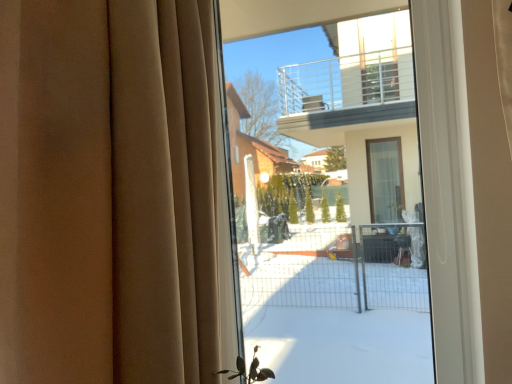
At what (x,y) coordinates should I click in order to perform the action: click on beige fabric curtain at left. Please return your answer as a coordinate pair (x, y). The width and height of the screenshot is (512, 384). Looking at the image, I should click on (106, 192).

Describe the element at coordinates (106, 192) in the screenshot. I see `beige fabric curtain at left` at that location.

What is the approximate height of beige fabric curtain at left?

It is 1.03 meters.

The width and height of the screenshot is (512, 384). What do you see at coordinates (333, 195) in the screenshot?
I see `transparent glass bay window at center` at bounding box center [333, 195].

Identify the location of transparent glass bay window at center. (333, 195).

You are a GUI agent. You are given a task and a screenshot of the screen. Output one action in this format:
    pyautogui.click(x=<x>, y=<y>)
    Task: Click on the beige fabric curtain at left
    The height and width of the screenshot is (384, 512).
    Given the screenshot: What is the action you would take?
    pyautogui.click(x=106, y=192)

Consider the image. Which is more to the left, transparent glass bay window at center or beige fabric curtain at left?

From the viewer's perspective, beige fabric curtain at left appears more on the left side.

Considering the positions of objects transparent glass bay window at center and beige fabric curtain at left in the image provided, who is in front, transparent glass bay window at center or beige fabric curtain at left?

beige fabric curtain at left.

Which is nearer, (372, 295) or (124, 345)?

The point (124, 345) is closer to the camera.

From the image's perspective, which one is positioned higher, transparent glass bay window at center or beige fabric curtain at left?

transparent glass bay window at center appears higher in the image.

From a real-world perspective, which is physically above, transparent glass bay window at center or beige fabric curtain at left?

beige fabric curtain at left.

Looking at this image, between transparent glass bay window at center and beige fabric curtain at left, which one has larger width?

beige fabric curtain at left is wider.

Consider the image. Is transparent glass bay window at center taller or shorter than beige fabric curtain at left?

transparent glass bay window at center is taller than beige fabric curtain at left.

Considering the relative sizes of transparent glass bay window at center and beige fabric curtain at left in the image provided, is transparent glass bay window at center smaller than beige fabric curtain at left?

Indeed, transparent glass bay window at center has a smaller size compared to beige fabric curtain at left.

Would you say transparent glass bay window at center is inside or outside beige fabric curtain at left?

transparent glass bay window at center cannot be found inside beige fabric curtain at left.

Are transparent glass bay window at center and beige fabric curtain at left making contact?

No, transparent glass bay window at center is not in contact with beige fabric curtain at left.

Is transparent glass bay window at center oriented away from beige fabric curtain at left?

No, beige fabric curtain at left is not at the back of transparent glass bay window at center.

What's the angular difference between transparent glass bay window at center and beige fabric curtain at left's facing directions?

They differ by 89.7 degrees in their facing directions.

Where is `curtain below the transparent glass bay window at center (from the image's perspective)`? curtain below the transparent glass bay window at center (from the image's perspective) is located at coordinates (106, 192).

Can you confirm if beige fabric curtain at left is positioned to the right of transparent glass bay window at center?

No.

Is beige fabric curtain at left further to camera compared to transparent glass bay window at center?

No, beige fabric curtain at left is in front of transparent glass bay window at center.

Is point (39, 134) less distant than point (288, 126)?

Yes, it is.

From the image's perspective, who appears lower, beige fabric curtain at left or transparent glass bay window at center?

beige fabric curtain at left is shown below in the image.

Consider the image. From a real-world perspective, which is physically above, beige fabric curtain at left or transparent glass bay window at center?

From a 3D spatial view, beige fabric curtain at left is above.

Consider the image. Considering the sizes of beige fabric curtain at left and transparent glass bay window at center in the image, is beige fabric curtain at left wider or thinner than transparent glass bay window at center?

Clearly, beige fabric curtain at left has more width compared to transparent glass bay window at center.

Can you confirm if beige fabric curtain at left is taller than transparent glass bay window at center?

Incorrect, the height of beige fabric curtain at left is not larger of that of transparent glass bay window at center.

Which of these two, beige fabric curtain at left or transparent glass bay window at center, is smaller?

With smaller size is transparent glass bay window at center.

Looking at this image, is beige fabric curtain at left not inside transparent glass bay window at center?

beige fabric curtain at left lies outside transparent glass bay window at center's area.

Is beige fabric curtain at left placed right next to transparent glass bay window at center?

No, beige fabric curtain at left is not making contact with transparent glass bay window at center.

Is beige fabric curtain at left turned away from transparent glass bay window at center?

No, transparent glass bay window at center is not at the back of beige fabric curtain at left.

Find the location of a particular element. curtain on the left of transparent glass bay window at center is located at coordinates (106, 192).

The height and width of the screenshot is (384, 512). Find the location of `bay window directly beneath the beige fabric curtain at left (from a real-world perspective)`. bay window directly beneath the beige fabric curtain at left (from a real-world perspective) is located at coordinates tap(333, 195).

Where is `curtain below the transparent glass bay window at center (from the image's perspective)`? This screenshot has height=384, width=512. curtain below the transparent glass bay window at center (from the image's perspective) is located at coordinates (106, 192).